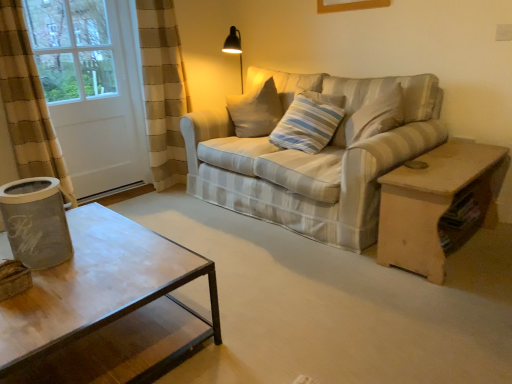
Locate an element on the screen. The image size is (512, 384). vacant space underneath white matte screen door at left (from a real-world perspective) is located at coordinates (111, 195).